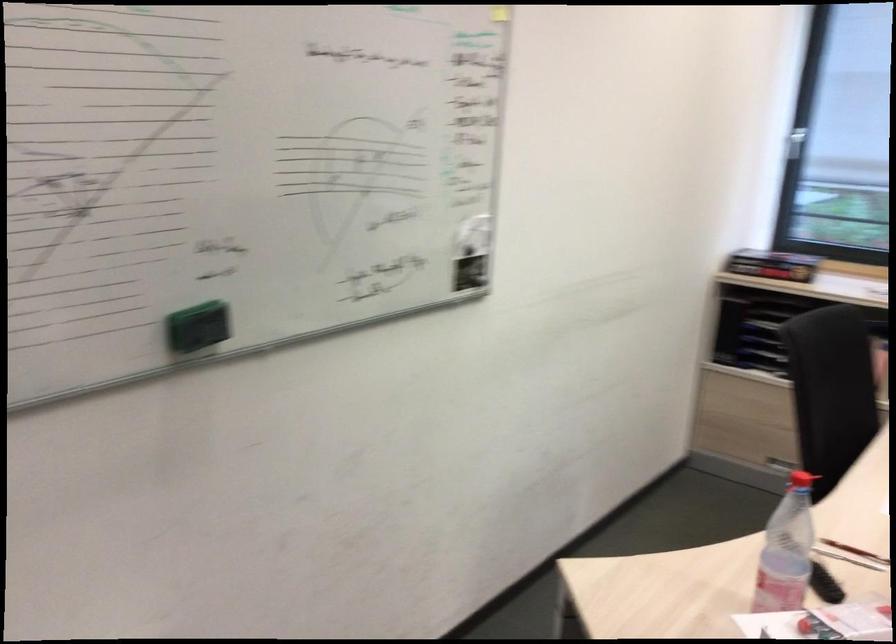
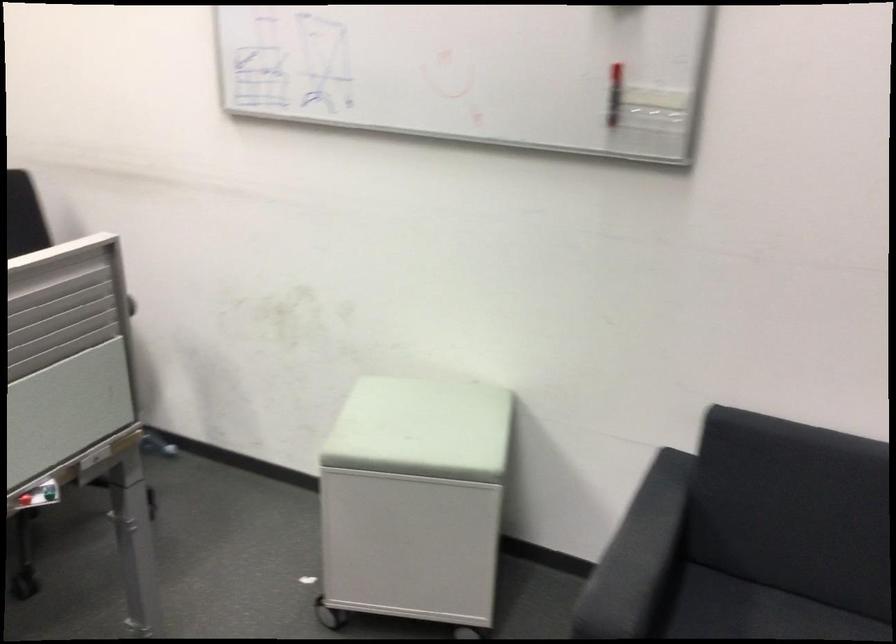
In the scene shown: How did the camera likely rotate?

The camera rotated toward right-down.